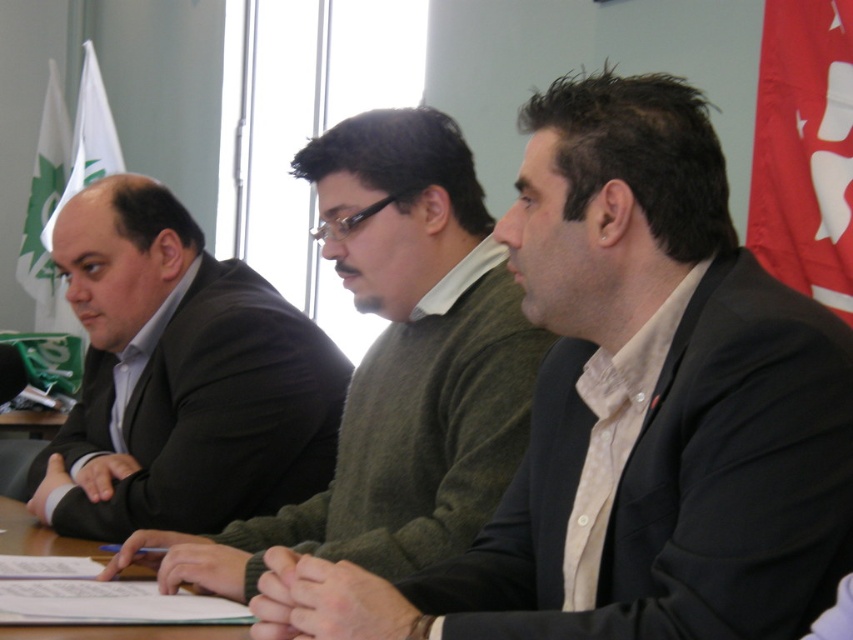
Question: Is dark brown suit at left bigger than wooden table at center?

Choices:
 (A) no
 (B) yes

Answer: (B)

Question: Does green sweater at center appear on the right side of wooden table at center?

Choices:
 (A) yes
 (B) no

Answer: (A)

Question: Can you confirm if dark green sweater at center is thinner than dark brown suit at left?

Choices:
 (A) no
 (B) yes

Answer: (B)

Question: Which point appears closest to the camera in this image?

Choices:
 (A) (129, 572)
 (B) (207, 296)

Answer: (A)

Question: Which object is closer to the camera taking this photo?

Choices:
 (A) green sweater at center
 (B) wooden table at center
 (C) dark green sweater at center
 (D) dark brown suit at left

Answer: (C)

Question: Which of the following is the closest to the observer?

Choices:
 (A) click(84, 243)
 (B) click(686, 260)

Answer: (B)